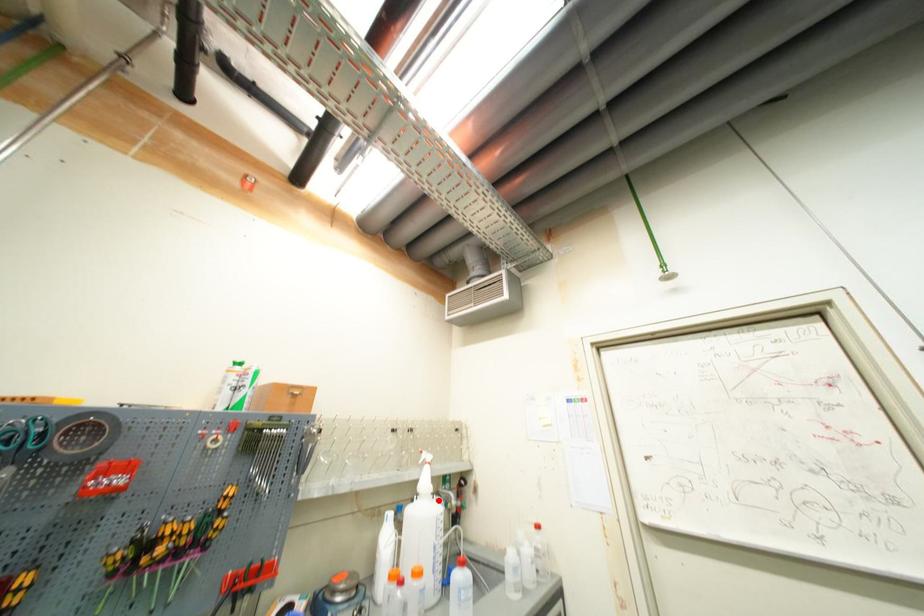
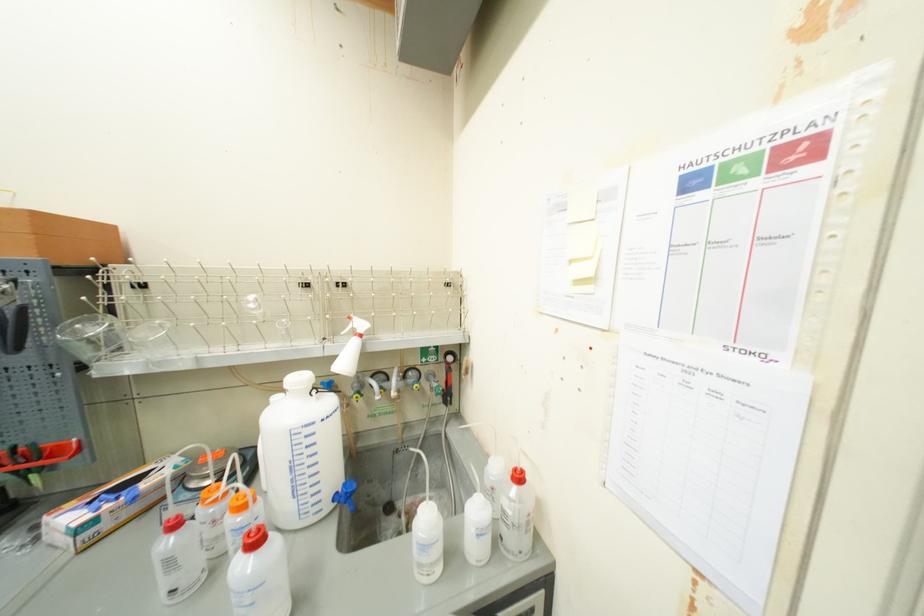
Where in the second image is the point corresponding to the highlighted location from the first image?

(317, 398)